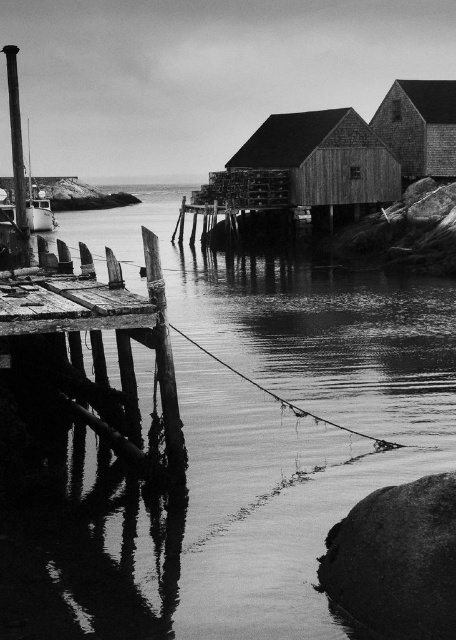
Question: Which of the following is the farthest from the observer?

Choices:
 (A) (x=393, y=116)
 (B) (x=300, y=182)
 (C) (x=362, y=385)

Answer: (A)

Question: Considering the relative positions of wooden hut at center and smooth wood pole at left in the image provided, where is wooden hut at center located with respect to smooth wood pole at left?

Choices:
 (A) below
 (B) above

Answer: (A)

Question: Among these objects, which one is farthest from the camera?

Choices:
 (A) reflective wet wood at lower left
 (B) wooden cabin at upper right
 (C) wooden hut at center

Answer: (B)

Question: Based on their relative distances, which object is nearer to the wooden cabin at upper right?

Choices:
 (A) wooden hut at center
 (B) reflective wet wood at lower left

Answer: (A)

Question: Can you confirm if reflective wet wood at lower left is positioned to the left of wooden cabin at upper right?

Choices:
 (A) yes
 (B) no

Answer: (A)

Question: Considering the relative positions of wooden hut at center and smooth wood pole at left in the image provided, where is wooden hut at center located with respect to smooth wood pole at left?

Choices:
 (A) right
 (B) left

Answer: (A)